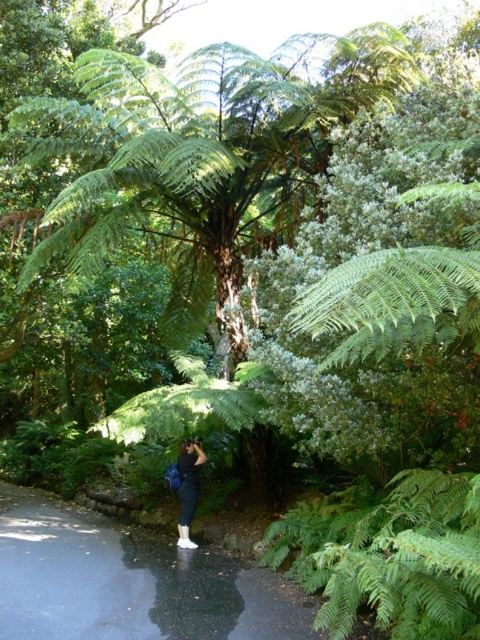
Question: Which point appears closest to the camera in this image?

Choices:
 (A) (288, 580)
 (B) (184, 460)

Answer: (A)

Question: Does shiny asphalt path at center have a larger size compared to green leafy fern at lower right?

Choices:
 (A) no
 (B) yes

Answer: (A)

Question: Which of the following is the farthest from the observer?

Choices:
 (A) (399, 596)
 (B) (191, 515)

Answer: (B)

Question: Considering the real-world distances, which object is closest to the green leafy fern at lower right?

Choices:
 (A) shiny asphalt path at center
 (B) denim pants at lower center

Answer: (B)

Question: Can you confirm if shiny asphalt path at center is positioned to the left of denim pants at lower center?

Choices:
 (A) yes
 (B) no

Answer: (A)

Question: Is shiny asphalt path at center above denim pants at lower center?

Choices:
 (A) yes
 (B) no

Answer: (B)